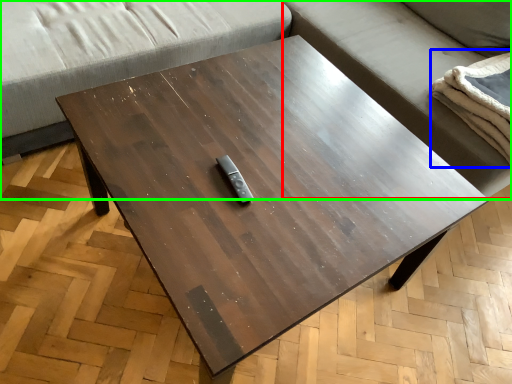
Question: Considering the real-world distances, which object is farthest from couch (highlighted by a red box)? blanket (highlighted by a blue box) or studio couch (highlighted by a green box)?

Choices:
 (A) blanket
 (B) studio couch

Answer: (A)